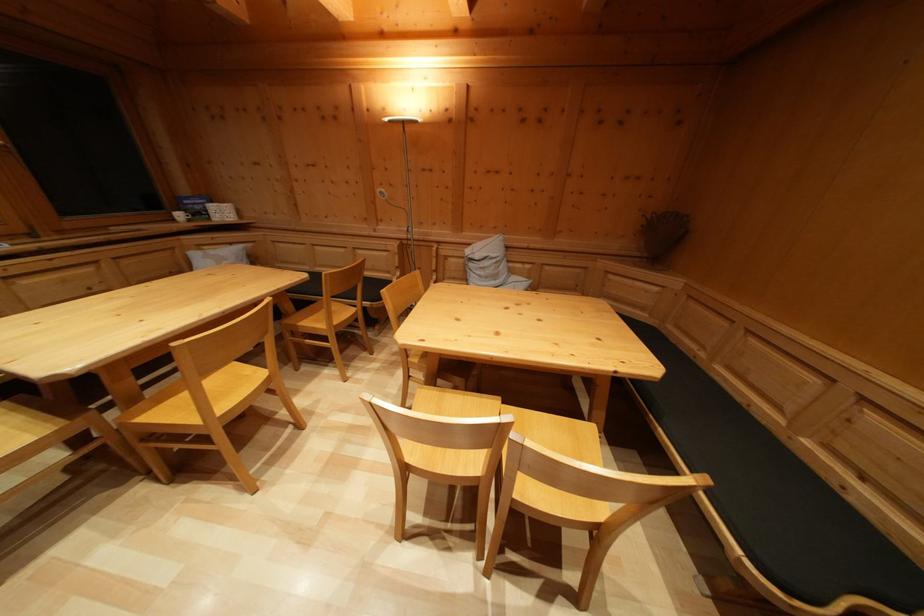
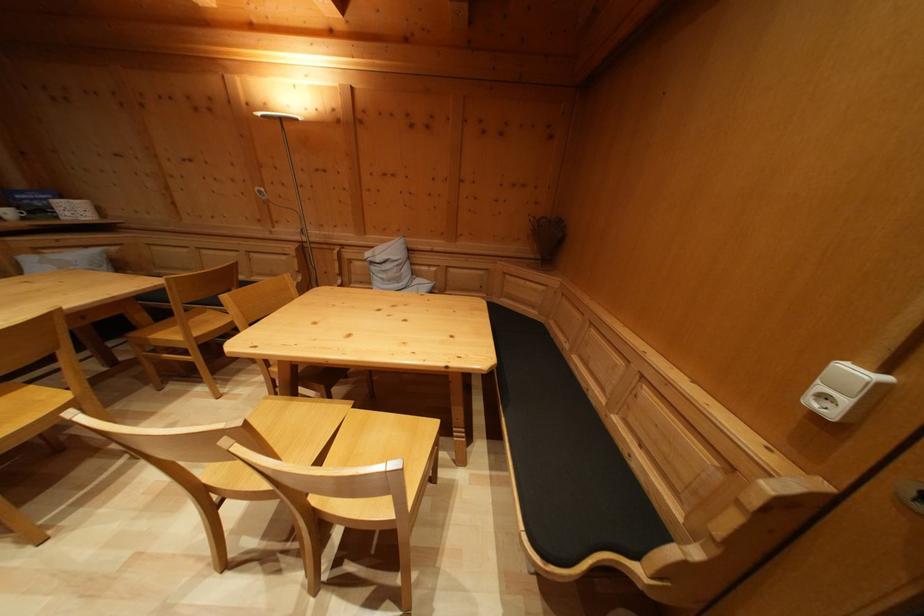
Find the pixel in the second image that matches point 442,392 in the first image.

(300, 400)